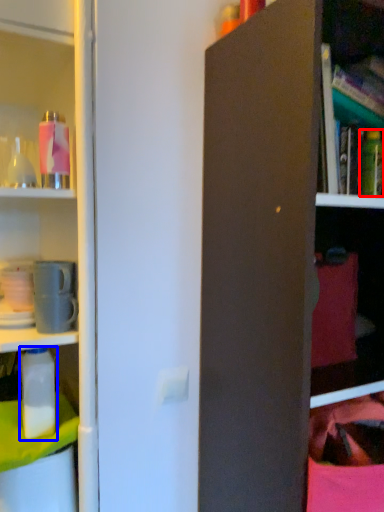
Question: Among these objects, which one is farthest to the camera, bottle (highlighted by a red box) or bottle (highlighted by a blue box)?

Choices:
 (A) bottle
 (B) bottle

Answer: (A)